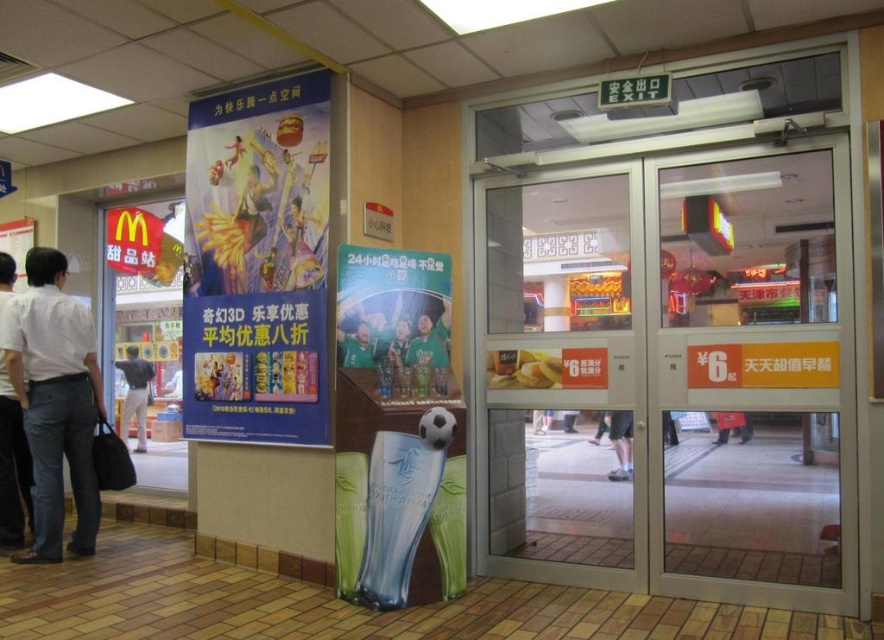
Question: Among these points, which one is nearest to the camera?

Choices:
 (A) (303, 289)
 (B) (439, 337)

Answer: (B)

Question: From the image, what is the correct spatial relationship of vivid paper poster at upper left in relation to yellow fabric mcdonald's sign at left?

Choices:
 (A) below
 (B) above

Answer: (B)

Question: Is dark blue shirt at left wider than red fabric bag at center?

Choices:
 (A) yes
 (B) no

Answer: (A)

Question: Is vivid paper poster at upper left positioned before white shirt at left?

Choices:
 (A) no
 (B) yes

Answer: (B)

Question: Which point is closer to the camera taking this photo?

Choices:
 (A) (150, 332)
 (B) (347, 292)
 (C) (97, 492)

Answer: (B)

Question: Estimate the real-world distances between objects in this image. Which object is farther from the red fabric bag at center?

Choices:
 (A) vivid paper poster at upper left
 (B) yellow fabric mcdonald's sign at left
 (C) light gray pants at left

Answer: (B)